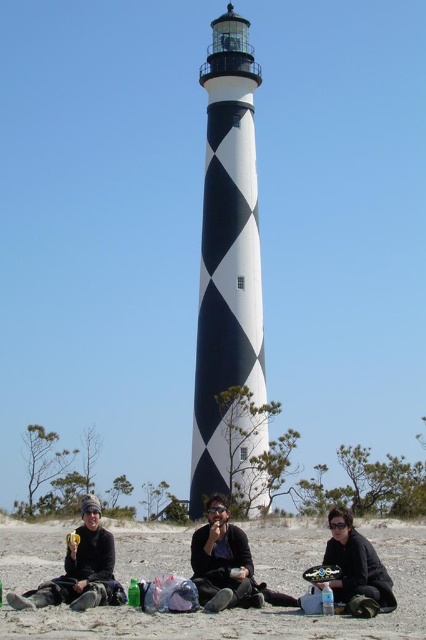
Question: Estimate the real-world distances between objects in this image. Which object is closer to the black sand at lower center?

Choices:
 (A) black matte jacket at lower center
 (B) matte black jacket at lower left
 (C) matte black sunglasses at center

Answer: (C)

Question: Does black sand at lower center have a greater width compared to black matte jacket at lower center?

Choices:
 (A) no
 (B) yes

Answer: (B)

Question: Which of the following is the closest to the observer?

Choices:
 (A) (368, 561)
 (B) (226, 588)
 (C) (109, 548)

Answer: (B)

Question: Is matte black sunglasses at center further to camera compared to black matte jacket at lower center?

Choices:
 (A) no
 (B) yes

Answer: (B)

Question: Which point is closer to the camera?

Choices:
 (A) (360, 541)
 (B) (226, 504)

Answer: (A)

Question: Does black sand at lower center lie behind black matte jacket at lower center?

Choices:
 (A) no
 (B) yes

Answer: (A)